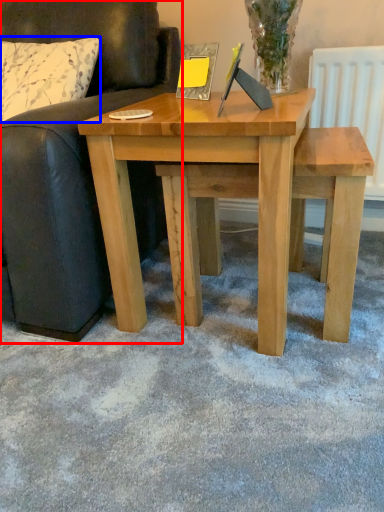
Question: Which of the following is the farthest to the observer, studio couch (highlighted by a red box) or pillow (highlighted by a blue box)?

Choices:
 (A) studio couch
 (B) pillow

Answer: (B)